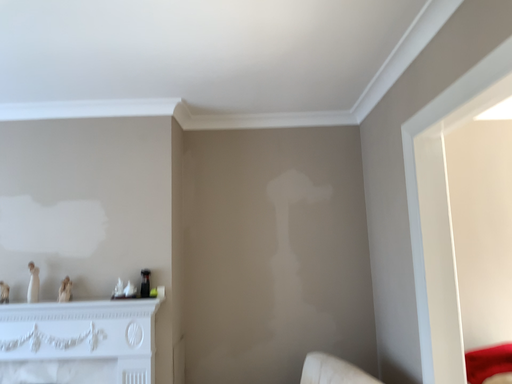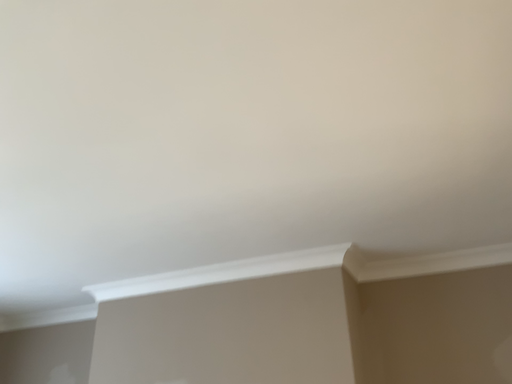
Question: Which way did the camera rotate in the video?

Choices:
 (A) rotated upward
 (B) rotated downward

Answer: (A)